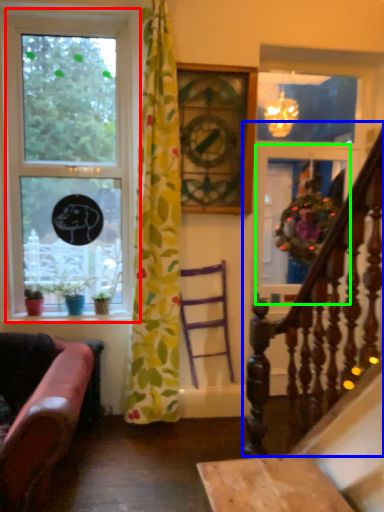
Question: Which is farther away from window (highlighted by a red box)? rail (highlighted by a blue box) or glass door (highlighted by a green box)?

Choices:
 (A) rail
 (B) glass door

Answer: (A)